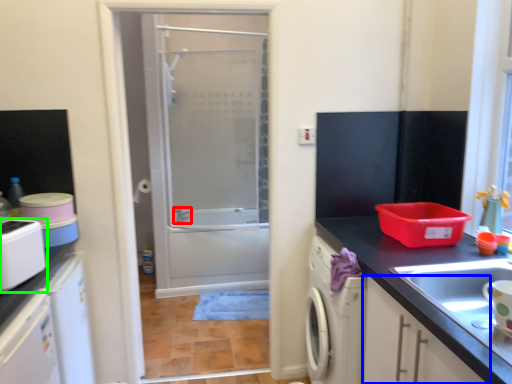
Question: Which object is positioned closest to faucet (highlighted by a red box)? Select from cabinetry (highlighted by a blue box) and appliance (highlighted by a green box).

Choices:
 (A) cabinetry
 (B) appliance

Answer: (B)